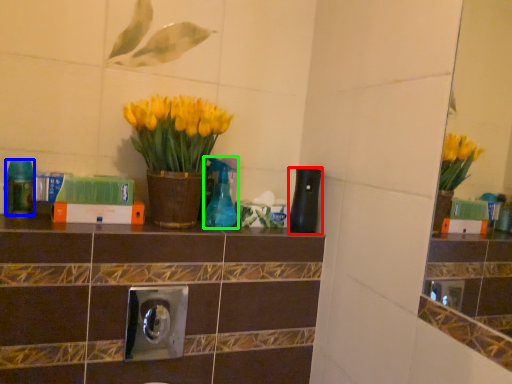
Question: Which object is the farthest from bottle (highlighted by a red box)? Choose among these: bottle (highlighted by a blue box) or bottle (highlighted by a green box).

Choices:
 (A) bottle
 (B) bottle

Answer: (A)